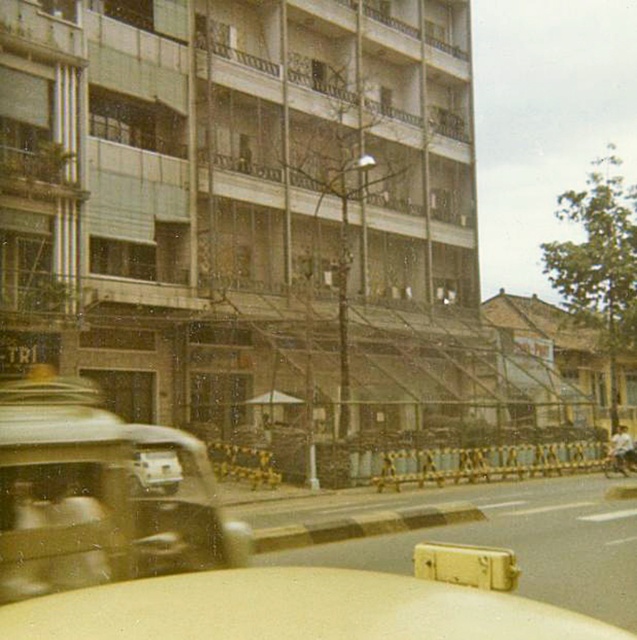
Is metallic gold car at left positioned at the back of shiny chrome motorcycle at right?

No, metallic gold car at left is closer to the viewer.

Which is behind, point (15, 422) or point (613, 468)?

Positioned behind is point (613, 468).

The width and height of the screenshot is (637, 640). In order to click on metallic gold car at left in this screenshot , I will do tap(96, 497).

Consider the image. Is yellow matte car at center above metallic gold car at left?

Yes.

Can you confirm if yellow matte car at center is positioned to the left of metallic gold car at left?

No, yellow matte car at center is not to the left of metallic gold car at left.

Is point (11, 602) positioned behind point (68, 506)?

No, (11, 602) is in front of (68, 506).

Identify the location of yellow matte car at center. Image resolution: width=637 pixels, height=640 pixels. (189, 554).

Is point (204, 516) less distant than point (634, 458)?

Yes, it is.

Can you confirm if yellow matte car at center is taller than shiny chrome motorcycle at right?

Correct, yellow matte car at center is much taller as shiny chrome motorcycle at right.

Where is `yellow matte car at center`? The width and height of the screenshot is (637, 640). yellow matte car at center is located at coordinates (189, 554).